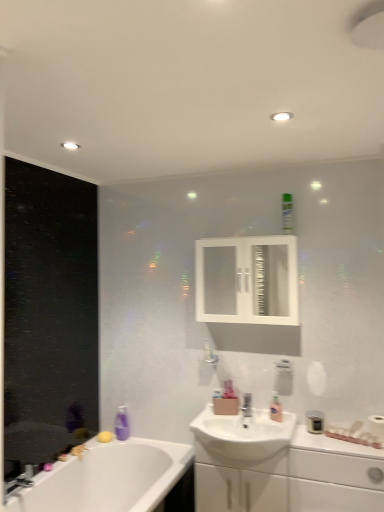
Image resolution: width=384 pixels, height=512 pixels. What do you see at coordinates (122, 424) in the screenshot?
I see `purple plastic soap dispenser at lower left` at bounding box center [122, 424].

This screenshot has width=384, height=512. Describe the element at coordinates (18, 480) in the screenshot. I see `chrome metallic faucet at lower left, acting as the second tap starting from the back` at that location.

What do you see at coordinates (287, 213) in the screenshot? The image size is (384, 512). I see `green matte bottle at upper center, positioned as the second toiletry in right-to-left order` at bounding box center [287, 213].

Where is `white matte toilet paper at right`? white matte toilet paper at right is located at coordinates (377, 426).

At what (x,y) coordinates should I click in order to perform the action: click on purple plastic soap dispenser at lower left. Please return your answer as a coordinate pair (x, y). This screenshot has width=384, height=512. Looking at the image, I should click on (122, 424).

From the image's perspective, would you say white glossy sink at center is positioned over white glossy bathtub at lower left?

Indeed, from the image's perspective, white glossy sink at center is shown above white glossy bathtub at lower left.

This screenshot has height=512, width=384. What are the coordinates of `sink located behind the white glossy bathtub at lower left` in the screenshot? It's located at (244, 434).

From the picture: Is white glossy sink at center aimed at white glossy bathtub at lower left?

No, white glossy sink at center is not oriented towards white glossy bathtub at lower left.

Does white glossy sink at center appear on the left side of white glossy bathtub at lower left?

No, white glossy sink at center is not to the left of white glossy bathtub at lower left.

Considering the positions of objects white glossy medicine cabinet at upper center and green matte bottle at upper center, marked as the third toiletry in a bottom-to-top arrangement, in the image provided, who is more to the left, white glossy medicine cabinet at upper center or green matte bottle at upper center, marked as the third toiletry in a bottom-to-top arrangement,?

Positioned to the left is white glossy medicine cabinet at upper center.

From the picture: Is white glossy medicine cabinet at upper center facing away from green matte bottle at upper center, the 1th toiletry from the top?

white glossy medicine cabinet at upper center does not have its back to green matte bottle at upper center, the 1th toiletry from the top.

Is point (261, 257) farther from camera compared to point (290, 228)?

That is False.

Is white glossy medicine cabinet at upper center wider than green matte bottle at upper center, placed as the second toiletry when sorted from left to right?

Yes, white glossy medicine cabinet at upper center is wider than green matte bottle at upper center, placed as the second toiletry when sorted from left to right.

Considering the sizes of objects green matte bottle at upper center, positioned as the second toiletry in right-to-left order, and purple plastic soap dispenser at lower left in the image provided, who is bigger, green matte bottle at upper center, positioned as the second toiletry in right-to-left order, or purple plastic soap dispenser at lower left?

With larger size is green matte bottle at upper center, positioned as the second toiletry in right-to-left order.

Based on the photo, considering the sizes of green matte bottle at upper center, positioned as the second toiletry in right-to-left order, and purple plastic soap dispenser at lower left in the image, is green matte bottle at upper center, positioned as the second toiletry in right-to-left order, wider or thinner than purple plastic soap dispenser at lower left?

In the image, green matte bottle at upper center, positioned as the second toiletry in right-to-left order, appears to be wider than purple plastic soap dispenser at lower left.

This screenshot has height=512, width=384. I want to click on soap dispenser behind the green matte bottle at upper center, marked as the third toiletry in a bottom-to-top arrangement, so click(122, 424).

From the picture: Would you consider green matte bottle at upper center, marked as the third toiletry in a bottom-to-top arrangement, to be distant from purple plastic soap dispenser at lower left?

green matte bottle at upper center, marked as the third toiletry in a bottom-to-top arrangement, is far away from purple plastic soap dispenser at lower left.

From the image's perspective, who appears lower, chrome metallic faucet at lower left, the 2th tap viewed from the top, or white glossy sink at center?

chrome metallic faucet at lower left, the 2th tap viewed from the top, from the image's perspective.

From a real-world perspective, is chrome metallic faucet at lower left, which ranks as the 1th tap in bottom-to-top order, positioned over white glossy sink at center based on gravity?

No, from a real-world perspective, chrome metallic faucet at lower left, which ranks as the 1th tap in bottom-to-top order, is not above white glossy sink at center.

Measure the distance from chrome metallic faucet at lower left, the first tap from the front, to white glossy sink at center.

chrome metallic faucet at lower left, the first tap from the front, and white glossy sink at center are 3.74 feet apart.

Locate an element on the screen. The height and width of the screenshot is (512, 384). sink on the right of the chrome metallic faucet at lower left, the 1th tap positioned from the left is located at coordinates (244, 434).

Consider the image. Which is nearer, (101, 501) or (32, 475)?

Clearly, point (101, 501) is more distant from the camera than point (32, 475).

From a real-world perspective, does white glossy bathtub at lower left sit lower than chrome metallic faucet at lower left, the first tap from the front?

Correct, in the physical world, white glossy bathtub at lower left is lower than chrome metallic faucet at lower left, the first tap from the front.

Looking at this image, looking at their sizes, would you say white glossy bathtub at lower left is wider or thinner than chrome metallic faucet at lower left, the second tap viewed from the right?

Clearly, white glossy bathtub at lower left has more width compared to chrome metallic faucet at lower left, the second tap viewed from the right.

Is white glossy bathtub at lower left facing away from chrome metallic faucet at lower left, which ranks as the 1th tap in bottom-to-top order?

white glossy bathtub at lower left is not turned away from chrome metallic faucet at lower left, which ranks as the 1th tap in bottom-to-top order.

Considering the relative positions of white matte toilet paper at right and white glossy cabinet at lower right in the image provided, is white matte toilet paper at right to the left of white glossy cabinet at lower right from the viewer's perspective?

No, white matte toilet paper at right is not to the left of white glossy cabinet at lower right.

Is white matte toilet paper at right behind white glossy cabinet at lower right?

Yes, it is behind white glossy cabinet at lower right.

Choose the correct answer: Is white matte toilet paper at right inside white glossy cabinet at lower right or outside it?

white matte toilet paper at right exists outside the volume of white glossy cabinet at lower right.

Between white matte toilet paper at right and white glossy cabinet at lower right, which one has less height?

white matte toilet paper at right is shorter.

Is the surface of pink glossy lotion at sink, marked as the 2th toiletry in a bottom-to-top arrangement, in direct contact with green matte bottle at upper center, the 1th toiletry from the top?

No, pink glossy lotion at sink, marked as the 2th toiletry in a bottom-to-top arrangement, is not with green matte bottle at upper center, the 1th toiletry from the top.

Does point (270, 417) come closer to viewer compared to point (282, 200)?

Yes.

Does pink glossy lotion at sink, marked as the 2th toiletry in a bottom-to-top arrangement, turn towards green matte bottle at upper center, marked as the third toiletry in a bottom-to-top arrangement?

No, pink glossy lotion at sink, marked as the 2th toiletry in a bottom-to-top arrangement, is not facing towards green matte bottle at upper center, marked as the third toiletry in a bottom-to-top arrangement.

From the image's perspective, starting from the green matte bottle at upper center, marked as the third toiletry in a bottom-to-top arrangement, which toiletry is the 1st one below? Please provide its 2D coordinates.

[(276, 409)]

Where is `bathtub that appears below the white glossy sink at center (from the image's perspective)`? Image resolution: width=384 pixels, height=512 pixels. bathtub that appears below the white glossy sink at center (from the image's perspective) is located at coordinates (108, 478).

The height and width of the screenshot is (512, 384). I want to click on the 2nd toiletry to the right when counting from the white glossy medicine cabinet at upper center, so click(x=287, y=213).

Considering their positions, is pink glossy lotion at sink, positioned as the first toiletry in left-to-right order, positioned closer to chrome metallic faucet at lower left, the second tap viewed from the right, than white glossy sink at center?

white glossy sink at center.

Estimate the real-world distances between objects in this image. Which object is closer to pink glossy lotion at sink, marked as the third toiletry in a right-to-left arrangement, white matte toilet paper at right or satin nickel faucet at sink center, which is counted as the 1th tap, starting from the back?

satin nickel faucet at sink center, which is counted as the 1th tap, starting from the back, is closer to pink glossy lotion at sink, marked as the third toiletry in a right-to-left arrangement.

Estimate the real-world distances between objects in this image. Which object is further from white glossy sink at center, purple plastic soap dispenser at lower left or pink glossy lotion at sink, marked as the third toiletry in a right-to-left arrangement?

Among the two, purple plastic soap dispenser at lower left is located further to white glossy sink at center.

When comparing their distances from purple plastic soap dispenser at lower left, does white glossy cabinet at lower right or satin nickel faucet at sink center, the 2th tap in the left-to-right sequence, seem closer?

satin nickel faucet at sink center, the 2th tap in the left-to-right sequence.

When comparing their distances from white glossy bathtub at lower left, does white glossy cabinet at lower right or matte black canister at lower right, placed as the third toiletry when sorted from left to right, seem closer?

white glossy cabinet at lower right.

Which object lies nearer to the anchor point satin nickel faucet at sink center, the 2th tap in the left-to-right sequence, white matte toilet paper at right or white glossy bathtub at lower left?

Among the two, white matte toilet paper at right is located nearer to satin nickel faucet at sink center, the 2th tap in the left-to-right sequence.

Based on their spatial positions, is satin nickel faucet at sink center, the second tap positioned from the front, or white glossy sink at center closer to green matte bottle at upper center, marked as the third toiletry in a bottom-to-top arrangement?

Based on the image, satin nickel faucet at sink center, the second tap positioned from the front, appears to be nearer to green matte bottle at upper center, marked as the third toiletry in a bottom-to-top arrangement.

Estimate the real-world distances between objects in this image. Which object is closer to white glossy medicine cabinet at upper center, white glossy cabinet at lower right or white matte toilet paper at right?

white glossy cabinet at lower right.

Image resolution: width=384 pixels, height=512 pixels. What are the coordinates of `sink between green matte bottle at upper center, placed as the second toiletry when sorted from left to right, and white glossy cabinet at lower right vertically` in the screenshot? It's located at (244, 434).

Find the location of a particular element. toiletry between white glossy medicine cabinet at upper center and matte black canister at lower right, marked as the 3th toiletry in a top-to-bottom arrangement, in the vertical direction is located at coordinates (276, 409).

Identify the location of soap dispenser between chrome metallic faucet at lower left, the 2th tap viewed from the top, and white glossy medicine cabinet at upper center from left to right. Image resolution: width=384 pixels, height=512 pixels. (122, 424).

Where is `tap situated between purple plastic soap dispenser at lower left and matte black canister at lower right, placed as the third toiletry when sorted from left to right, from left to right`? Image resolution: width=384 pixels, height=512 pixels. tap situated between purple plastic soap dispenser at lower left and matte black canister at lower right, placed as the third toiletry when sorted from left to right, from left to right is located at coordinates (246, 410).